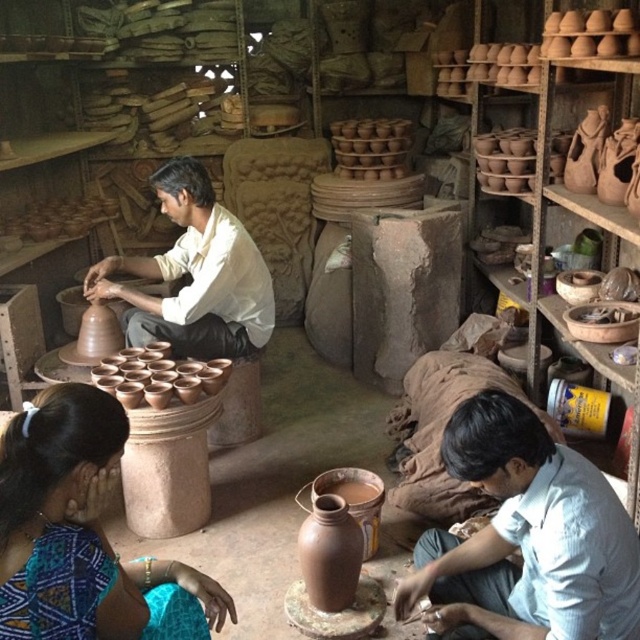
You are standing in the pottery workshop and notice the light blue cotton shirt at lower right and the matte clay potter at center. Which object is closer to the floor?

The light blue cotton shirt at lower right is shorter than the matte clay potter at center, so it is closer to the floor.

You are a pottery student observing the workshop. You notice the matte clay potter at center and the matte clay cups at center. Which object is taller?

The matte clay potter at center is much taller than the matte clay cups at center.